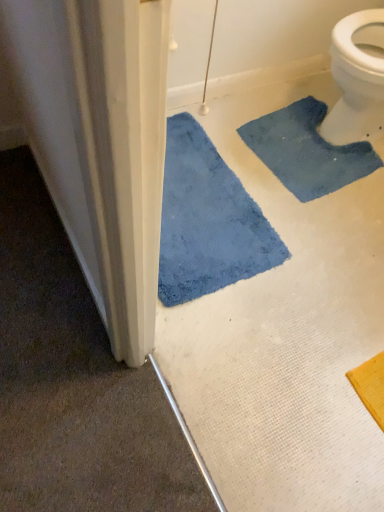
Find the location of `empty space that is ontop of blue fuzzy bath mat at upper right, the first bath mat from the right (from a real-world perspective)`. empty space that is ontop of blue fuzzy bath mat at upper right, the first bath mat from the right (from a real-world perspective) is located at coordinates [x=311, y=140].